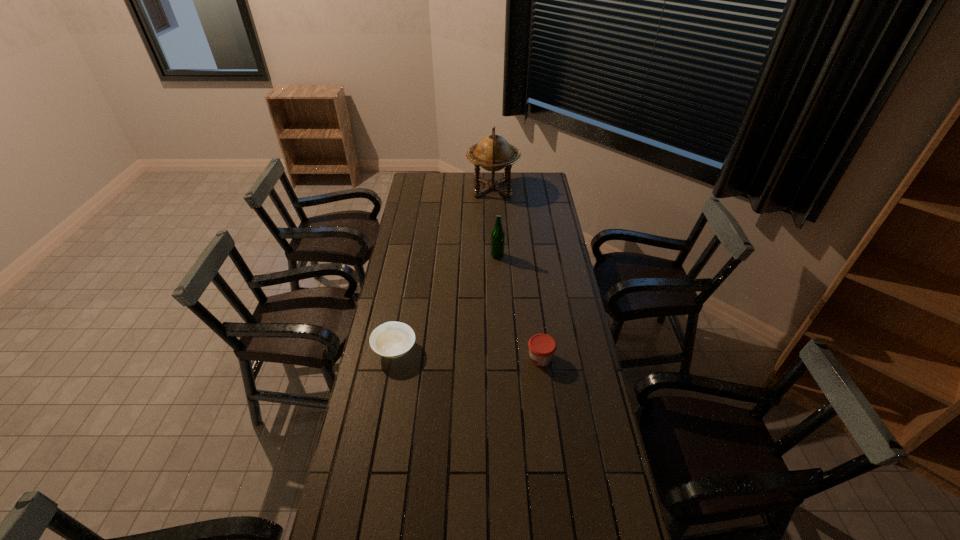
I want to click on free space at the far edge of the desktop, so click(468, 181).

In the image, there is a desktop. Identify the location of vacant space at the left edge. This screenshot has height=540, width=960. (405, 274).

I want to click on free space at the right edge, so click(564, 301).

Where is `vacant area at the far left corner`? This screenshot has height=540, width=960. vacant area at the far left corner is located at coordinates (426, 173).

The width and height of the screenshot is (960, 540). What are the coordinates of `vacant area that lies between the shortest object and the farthest object` in the screenshot? It's located at pyautogui.click(x=444, y=269).

Find the location of a particular element. This screenshot has width=960, height=540. free space between the jam and the beer bottle is located at coordinates (519, 307).

Locate an element on the screen. empty space that is in between the jam and the shortest object is located at coordinates (468, 354).

Find the location of a particular element. vacant point located between the jam and the bowl is located at coordinates (468, 354).

You are a GUI agent. You are given a task and a screenshot of the screen. Output one action in this format:
    pyautogui.click(x=<x>, y=<y>)
    Task: Click on the blank region between the third nearest object and the tallest object
    This screenshot has height=540, width=960.
    Given the screenshot: What is the action you would take?
    pyautogui.click(x=495, y=222)

Identify the location of unoccupied position between the second shortest object and the farthest object. (516, 273).